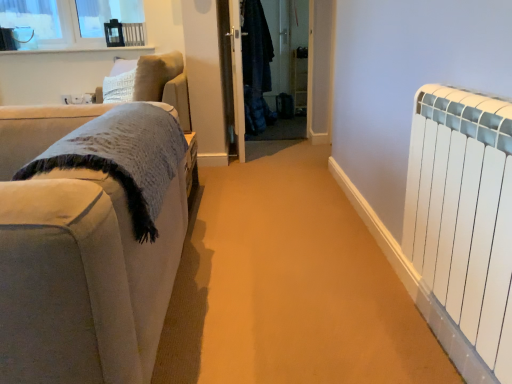
Question: From the image's perspective, is white matte radiator at right on white glossy window sill at upper left?

Choices:
 (A) no
 (B) yes

Answer: (A)

Question: Is white matte radiator at right positioned in front of white glossy window sill at upper left?

Choices:
 (A) no
 (B) yes

Answer: (B)

Question: Can you confirm if white matte radiator at right is wider than white glossy window sill at upper left?

Choices:
 (A) yes
 (B) no

Answer: (B)

Question: Is white matte radiator at right positioned behind white glossy window sill at upper left?

Choices:
 (A) yes
 (B) no

Answer: (B)

Question: Is white matte radiator at right next to white glossy window sill at upper left?

Choices:
 (A) yes
 (B) no

Answer: (B)

Question: In the image, is white glossy window sill at upper left positioned in front of or behind white matte radiator at right?

Choices:
 (A) behind
 (B) front

Answer: (A)

Question: From a real-world perspective, is white glossy window sill at upper left physically located above or below white matte radiator at right?

Choices:
 (A) above
 (B) below

Answer: (A)

Question: Visually, is white glossy window sill at upper left positioned to the left or to the right of white matte radiator at right?

Choices:
 (A) right
 (B) left

Answer: (B)

Question: Based on their sizes in the image, would you say white glossy window sill at upper left is bigger or smaller than white matte radiator at right?

Choices:
 (A) big
 (B) small

Answer: (B)

Question: In terms of width, does transparent glass door at center, the 2th screen door from the right, look wider or thinner when compared to denim jacket at center, positioned as the second screen door in left-to-right order?

Choices:
 (A) thin
 (B) wide

Answer: (A)

Question: From their relative heights in the image, would you say transparent glass door at center, the first screen door positioned from the left, is taller or shorter than denim jacket at center, positioned as the second screen door in left-to-right order?

Choices:
 (A) short
 (B) tall

Answer: (B)

Question: Considering the positions of point (232, 49) and point (271, 109), is point (232, 49) closer or farther from the camera than point (271, 109)?

Choices:
 (A) farther
 (B) closer

Answer: (B)

Question: Looking at the image, does transparent glass door at center, the first screen door positioned from the left, seem bigger or smaller compared to denim jacket at center, positioned as the second screen door in left-to-right order?

Choices:
 (A) small
 (B) big

Answer: (A)

Question: Considering their positions, is white glossy window sill at upper left located in front of or behind denim jacket at center, which ranks as the first screen door in right-to-left order?

Choices:
 (A) behind
 (B) front

Answer: (A)

Question: From the image's perspective, is white glossy window sill at upper left positioned above or below denim jacket at center, which ranks as the first screen door in right-to-left order?

Choices:
 (A) below
 (B) above

Answer: (B)